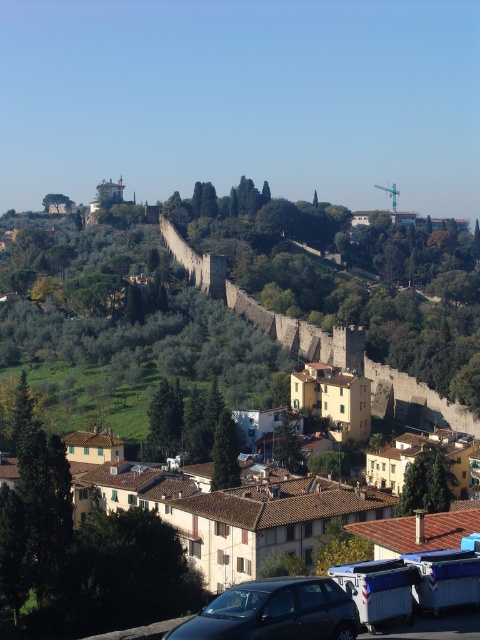
Between yellow stucco buildings at center and shiny black car at lower center, which one has less height?

shiny black car at lower center

Does point (213, 368) lie behind point (303, 614)?

Yes, point (213, 368) is behind point (303, 614).

The width and height of the screenshot is (480, 640). What are the coordinates of `yellow stucco buildings at center` in the screenshot? It's located at (208, 353).